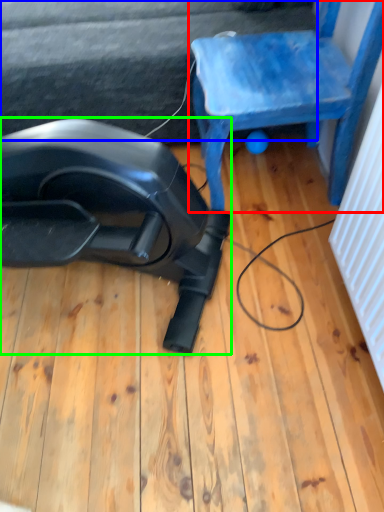
Question: Considering the real-world distances, which object is farthest from chair (highlighted by a red box)? surface (highlighted by a blue box) or equipment (highlighted by a green box)?

Choices:
 (A) surface
 (B) equipment

Answer: (B)